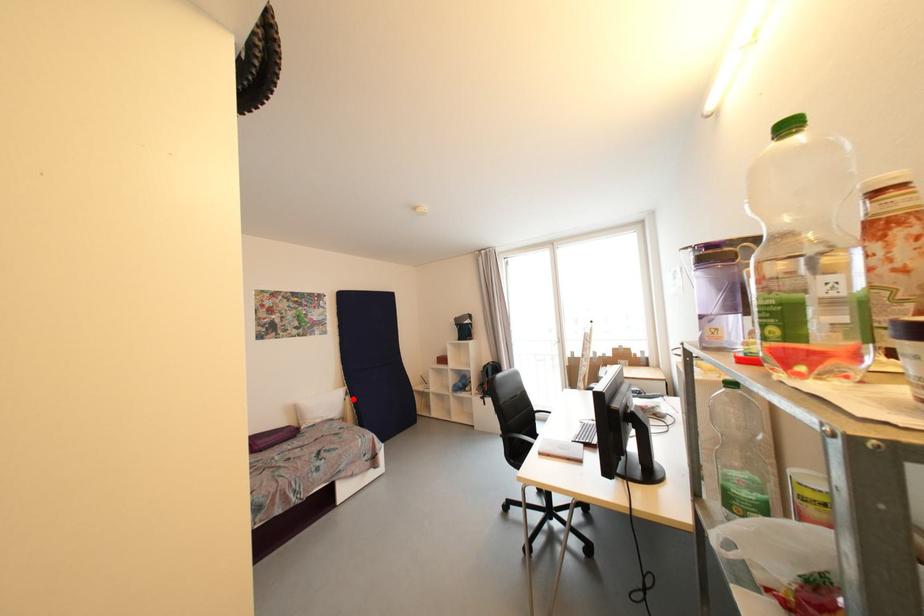
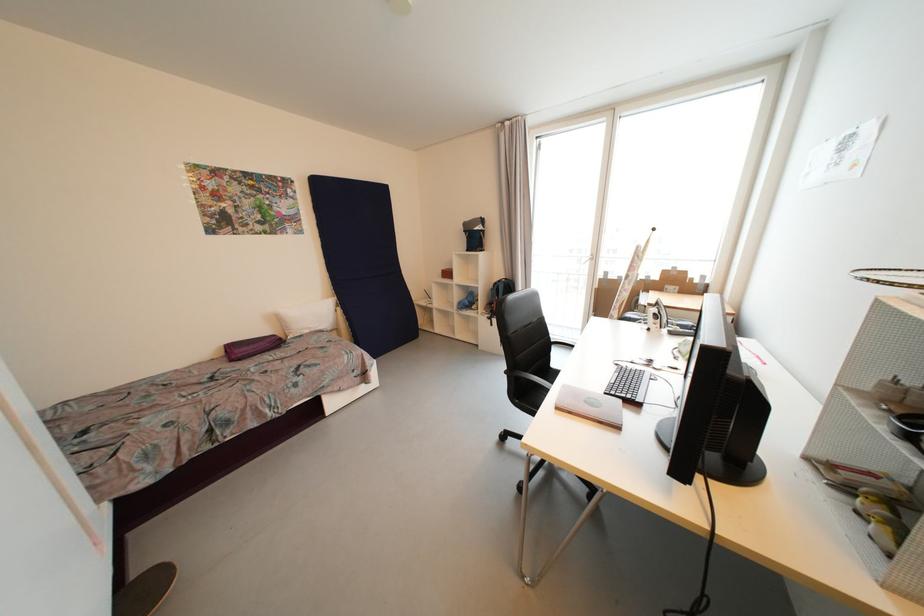
Question: A red point is marked in image1. In image2, is the corresponding 3D point closer to the camera or farther? Reply with the corresponding letter.

Choices:
 (A) The corresponding 3D point is closer.
 (B) The corresponding 3D point is farther.

Answer: (B)